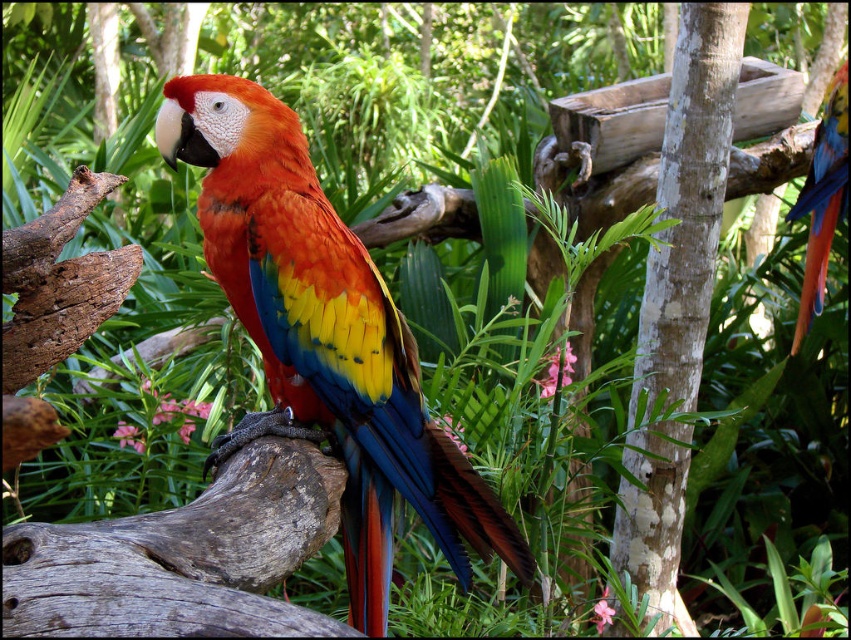
Does glossy feathers parrot at center come behind smooth bark tree trunk at center?

No, it is in front of smooth bark tree trunk at center.

Is point (330, 330) farther from camera compared to point (732, 64)?

No, (330, 330) is in front of (732, 64).

Locate an element on the screen. glossy feathers parrot at center is located at coordinates (324, 337).

Who is higher up, glossy feathers parrot at center or shiny multicolored parrot at upper right?

shiny multicolored parrot at upper right is above.

The image size is (851, 640). Identify the location of glossy feathers parrot at center. (324, 337).

You are a GUI agent. You are given a task and a screenshot of the screen. Output one action in this format:
    pyautogui.click(x=<x>, y=<y>)
    Task: Click on the glossy feathers parrot at center
    This screenshot has width=851, height=640.
    Given the screenshot: What is the action you would take?
    pyautogui.click(x=324, y=337)

Where is `glossy feathers parrot at center`? This screenshot has height=640, width=851. glossy feathers parrot at center is located at coordinates (324, 337).

Describe the element at coordinates (677, 301) in the screenshot. I see `smooth bark tree trunk at center` at that location.

Is smooth bark tree trunk at center wider than shiny multicolored parrot at upper right?

Correct, the width of smooth bark tree trunk at center exceeds that of shiny multicolored parrot at upper right.

Where is `smooth bark tree trunk at center`? Image resolution: width=851 pixels, height=640 pixels. smooth bark tree trunk at center is located at coordinates (677, 301).